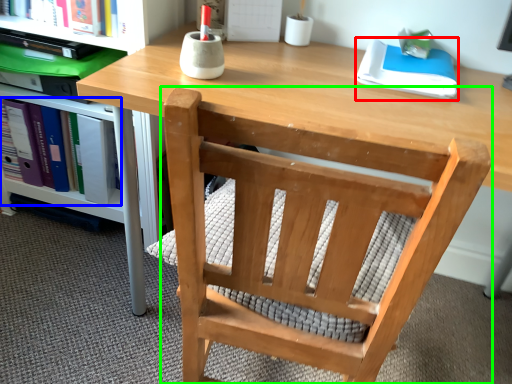
Question: Based on their relative distances, which object is farther from paperback book (highlighted by a red box)? Choose from book (highlighted by a blue box) and chair (highlighted by a green box).

Choices:
 (A) book
 (B) chair

Answer: (A)